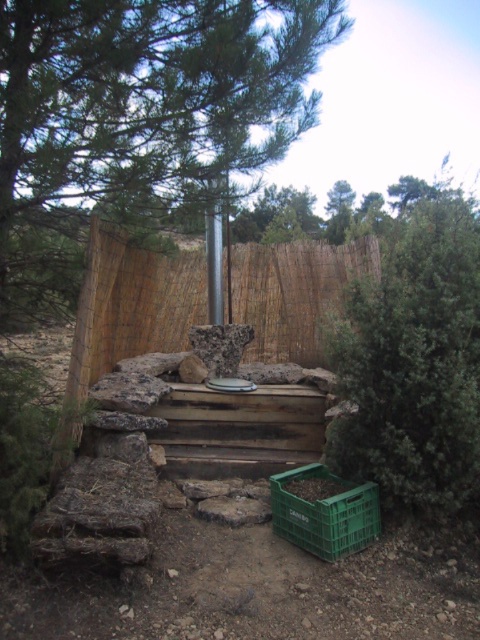
Question: Can you confirm if green leafy tree at center is thinner than green plastic crate at lower center?

Choices:
 (A) no
 (B) yes

Answer: (A)

Question: Considering the real-world distances, which object is closest to the green leafy tree at center?

Choices:
 (A) metallic pole at center
 (B) green plastic crate at lower center

Answer: (A)

Question: Observing the image, what is the correct spatial positioning of green leafy tree at center in reference to green leafy tree at right?

Choices:
 (A) above
 (B) below

Answer: (A)

Question: Among these objects, which one is nearest to the camera?

Choices:
 (A) green leafy tree at right
 (B) green leafy tree at center
 (C) metallic pole at center
 (D) green plastic crate at lower center

Answer: (B)

Question: Can you confirm if green leafy tree at right is bigger than metallic pole at center?

Choices:
 (A) yes
 (B) no

Answer: (A)

Question: Considering the real-world distances, which object is closest to the green plastic crate at lower center?

Choices:
 (A) green leafy tree at right
 (B) green leafy tree at center

Answer: (A)